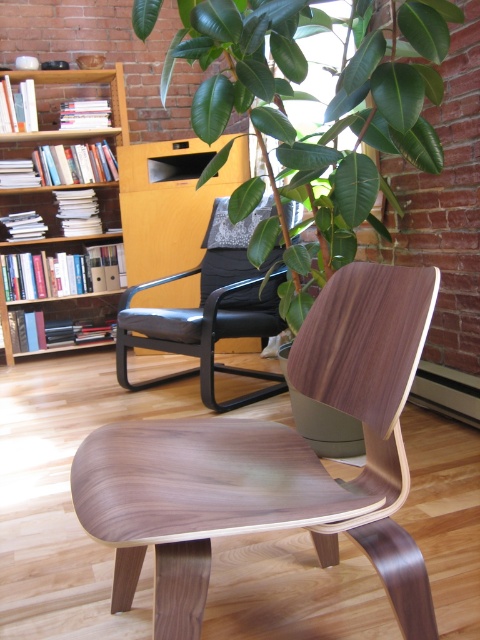
Is point (319, 540) more distant than point (202, 282)?

No, it is in front of (202, 282).

Is point (309, 499) less distant than point (140, 324)?

Yes, it is in front of point (140, 324).

Which is in front, point (379, 392) or point (179, 317)?

Point (379, 392) is in front.

Locate an element on the screen. The height and width of the screenshot is (640, 480). walnut wood swivel chair at center is located at coordinates (274, 461).

Between green leafy plant at upper center and black leather armchair at center, which one is positioned higher?

green leafy plant at upper center is above.

Is point (417, 157) farther from camera compared to point (168, 312)?

No, it is not.

The height and width of the screenshot is (640, 480). Find the location of `green leafy plant at upper center`. green leafy plant at upper center is located at coordinates (325, 109).

Describe the element at coordinates (274, 461) in the screenshot. I see `walnut wood swivel chair at center` at that location.

Who is positioned more to the left, walnut wood swivel chair at center or green leafy plant at upper center?

walnut wood swivel chair at center

You are a GUI agent. You are given a task and a screenshot of the screen. Output one action in this format:
    pyautogui.click(x=<x>, y=<y>)
    Task: Click on the walnut wood swivel chair at center
    
    Given the screenshot: What is the action you would take?
    pyautogui.click(x=274, y=461)